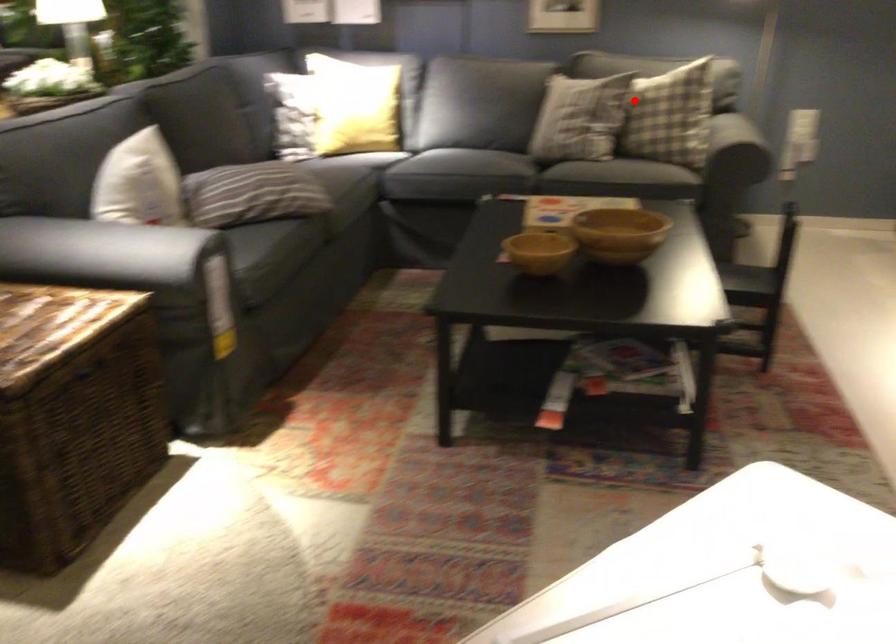
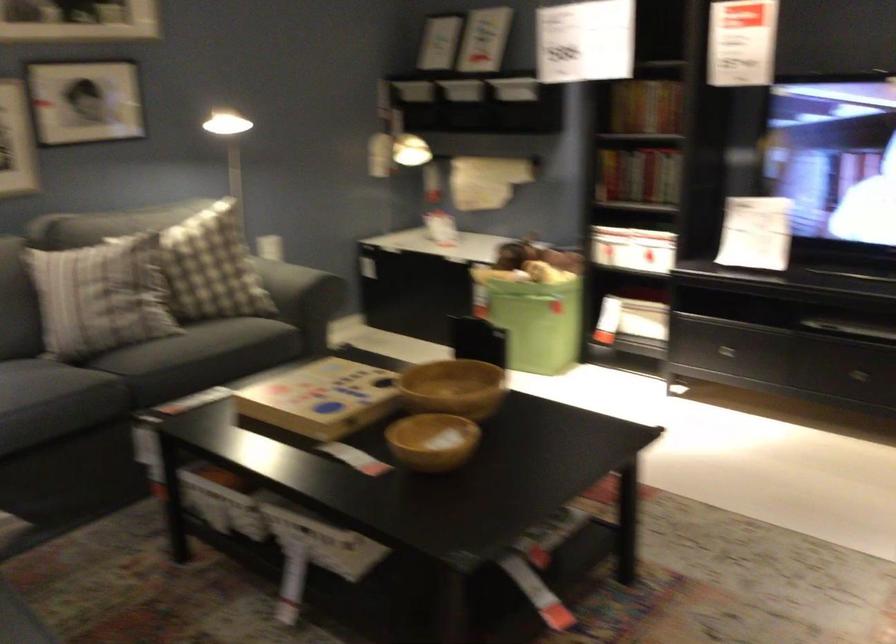
In the second image, find the point that corresponds to the highlighted location in the first image.

(211, 267)